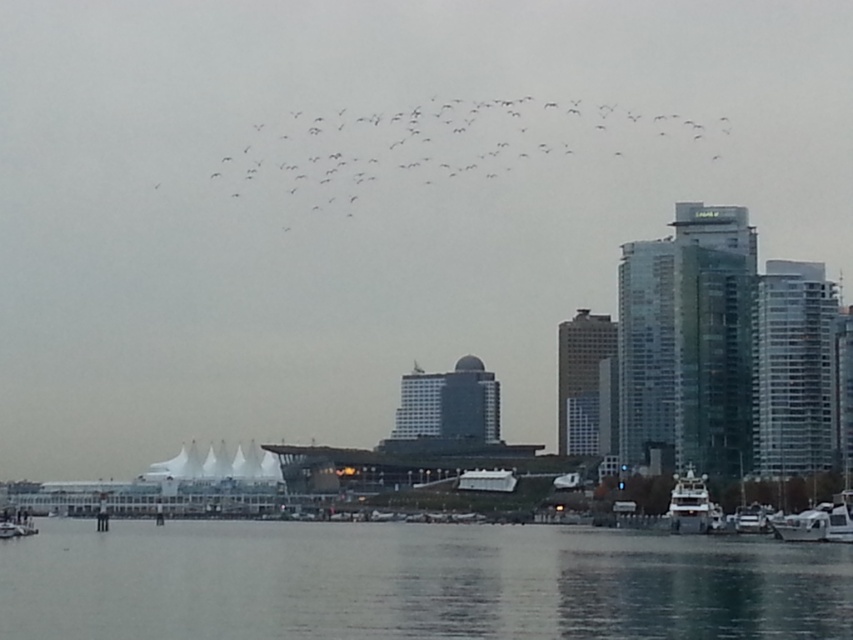
Which is behind, point (236, 608) or point (708, 515)?

Point (708, 515)

Is transparent water at lower center positioned behind white glossy yacht at lower right?

No, transparent water at lower center is in front of white glossy yacht at lower right.

Describe the element at coordinates (413, 582) in the screenshot. I see `transparent water at lower center` at that location.

Where is `transparent water at lower center`? The height and width of the screenshot is (640, 853). transparent water at lower center is located at coordinates (413, 582).